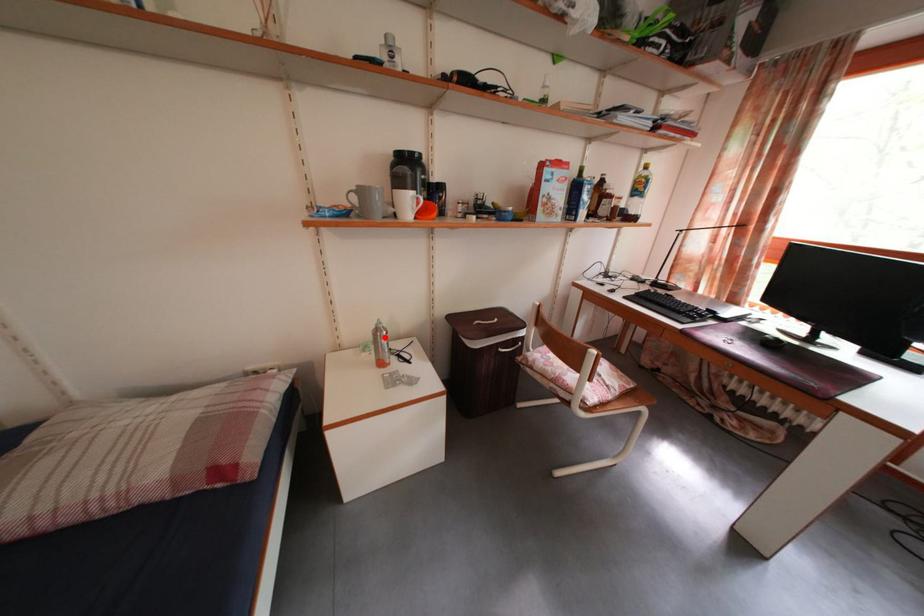
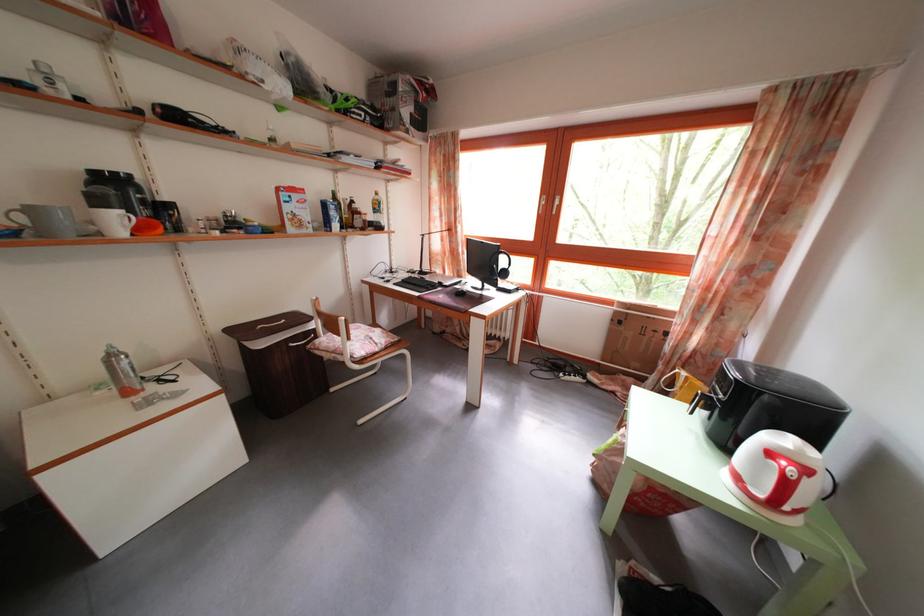
Locate, in the second image, the point that corresponds to the highlighted location in the first image.

(118, 363)